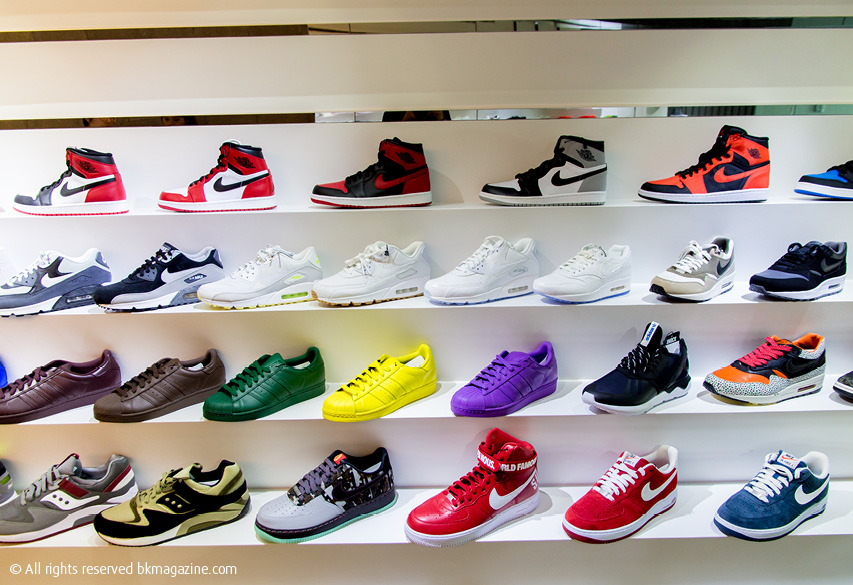
The image size is (853, 585). What are the coordinates of `shoes on the second highest shelf` in the screenshot? It's located at (66, 280), (155, 295), (257, 283), (368, 280), (473, 270), (584, 267), (698, 263), (792, 270).